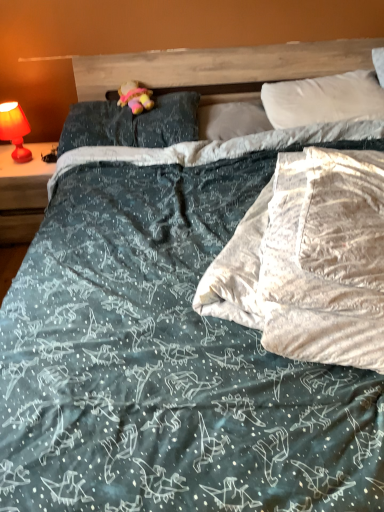
Locate an element on the screen. free space above matte red lamp at left (from a real-world perspective) is located at coordinates (27, 160).